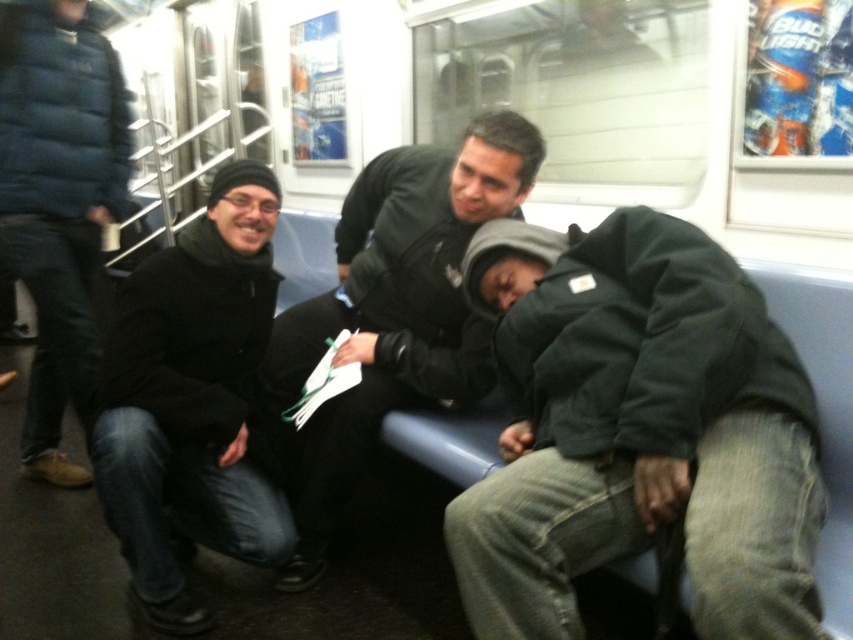
Question: Which object is the farthest from the dark green jacket at center?

Choices:
 (A) dark blue puffer jacket at left
 (B) dark green jacket at lower right

Answer: (A)

Question: Can you confirm if dark green jacket at lower right is positioned to the right of dark blue puffer jacket at left?

Choices:
 (A) yes
 (B) no

Answer: (A)

Question: Which point is farther to the camera?

Choices:
 (A) (44, 397)
 (B) (358, 392)

Answer: (A)

Question: Can you confirm if dark green jacket at center is positioned to the right of dark blue puffer jacket at left?

Choices:
 (A) yes
 (B) no

Answer: (A)

Question: Which point is closer to the camera?

Choices:
 (A) pos(13,141)
 (B) pos(405,205)
 (C) pos(750,500)
 (D) pos(276,218)

Answer: (C)

Question: Is black matte jacket at lower left to the right of dark green jacket at center from the viewer's perspective?

Choices:
 (A) no
 (B) yes

Answer: (A)